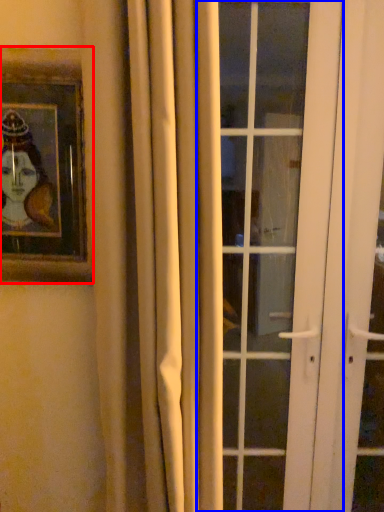
Question: Which object is closer to the camera taking this photo, picture frame (highlighted by a red box) or door (highlighted by a blue box)?

Choices:
 (A) picture frame
 (B) door

Answer: (A)